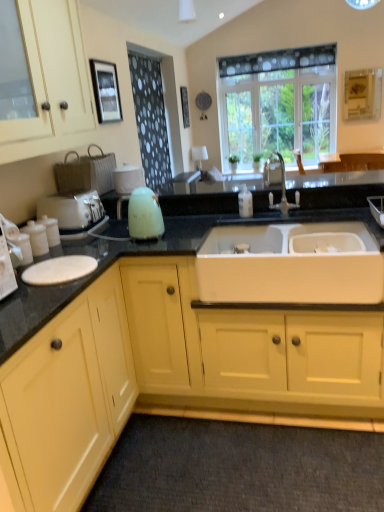
Question: From a real-world perspective, is black dotted fabric at upper left beneath white matte sink at center?

Choices:
 (A) yes
 (B) no

Answer: (B)

Question: Is black dotted fabric at upper left not inside white matte sink at center?

Choices:
 (A) no
 (B) yes

Answer: (B)

Question: Is black dotted fabric at upper left bigger than white matte sink at center?

Choices:
 (A) yes
 (B) no

Answer: (B)

Question: Is black dotted fabric at upper left oriented towards white matte sink at center?

Choices:
 (A) yes
 (B) no

Answer: (B)

Question: Is black dotted fabric at upper left shorter than white matte sink at center?

Choices:
 (A) no
 (B) yes

Answer: (A)

Question: Can you confirm if black dotted fabric at upper left is wider than white matte sink at center?

Choices:
 (A) yes
 (B) no

Answer: (B)

Question: From a real-world perspective, is transparent polka dot curtain at upper center physically above yellow matte cabinet at left, the first cabinetry in the bottom-to-top sequence?

Choices:
 (A) no
 (B) yes

Answer: (B)

Question: Does transparent polka dot curtain at upper center have a lesser height compared to yellow matte cabinet at left, the first cabinetry in the bottom-to-top sequence?

Choices:
 (A) yes
 (B) no

Answer: (B)

Question: Is transparent polka dot curtain at upper center positioned behind yellow matte cabinet at left, the first cabinetry in the bottom-to-top sequence?

Choices:
 (A) yes
 (B) no

Answer: (A)

Question: Would you consider transparent polka dot curtain at upper center to be distant from yellow matte cabinet at left, which is the second cabinetry in top-to-bottom order?

Choices:
 (A) yes
 (B) no

Answer: (A)

Question: Is transparent polka dot curtain at upper center to the left of yellow matte cabinet at left, the first cabinetry in the bottom-to-top sequence, from the viewer's perspective?

Choices:
 (A) no
 (B) yes

Answer: (A)

Question: Is transparent polka dot curtain at upper center with yellow matte cabinet at left, which is the second cabinetry in top-to-bottom order?

Choices:
 (A) yes
 (B) no

Answer: (B)

Question: Can you confirm if dark gray carpet at lower center is thinner than white plastic toaster at left?

Choices:
 (A) yes
 (B) no

Answer: (B)